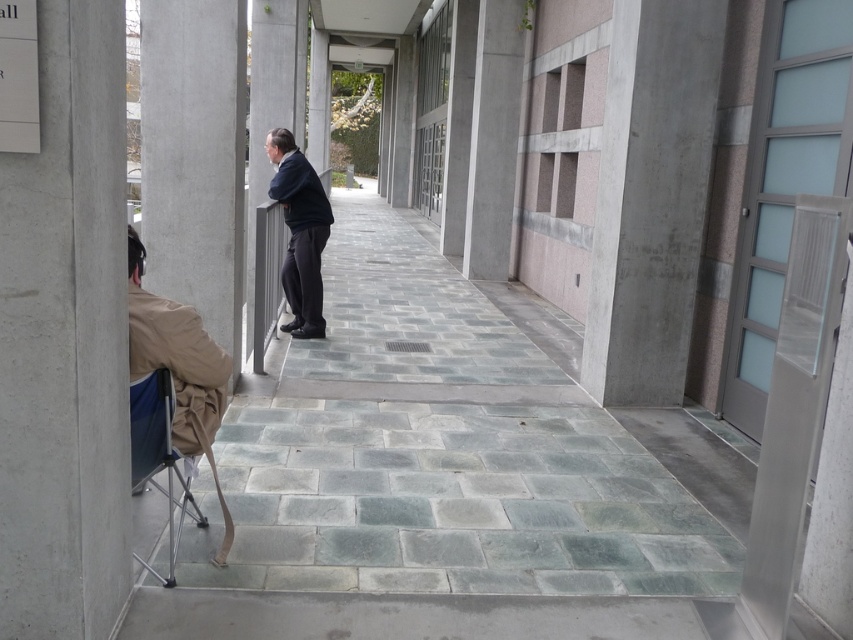
Question: Does gray concrete pillar at left appear on the left side of dark blue jacket at center?

Choices:
 (A) yes
 (B) no

Answer: (A)

Question: Estimate the real-world distances between objects in this image. Which object is closer to the tan fabric chair at lower left?

Choices:
 (A) gray concrete pillar at left
 (B) blue fabric folding chair at lower left

Answer: (B)

Question: Can you confirm if dark blue jacket at center is positioned above blue fabric folding chair at lower left?

Choices:
 (A) yes
 (B) no

Answer: (A)

Question: Which of these objects is positioned closest to the gray concrete pillar at left?

Choices:
 (A) dark blue jacket at center
 (B) tan fabric chair at lower left

Answer: (A)

Question: Which object appears farthest from the camera in this image?

Choices:
 (A) blue fabric folding chair at lower left
 (B) tan fabric chair at lower left
 (C) dark blue jacket at center

Answer: (C)

Question: Does gray concrete pillar at left have a smaller size compared to dark blue jacket at center?

Choices:
 (A) no
 (B) yes

Answer: (A)